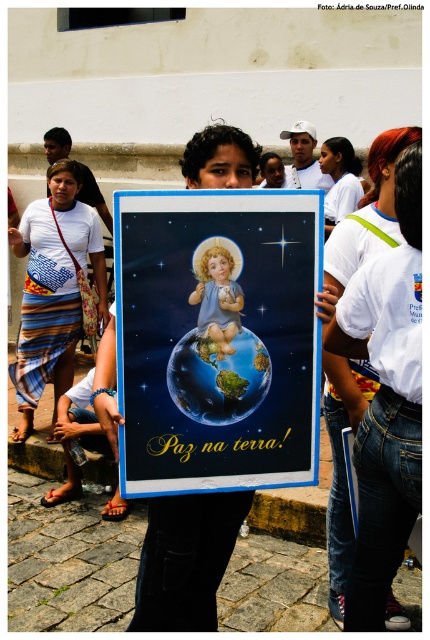
You are standing at the entrance of the event and want to locate the person wearing the white fabric shirt at center. According to the coordinates provided, in which direction should you look to find them?

The white fabric shirt at center is located at point 0.775 on the x and 0.893 on the y axis. Since the coordinates are in the upper right quadrant, you should look towards the upper right direction to find the person wearing the white fabric shirt at center.